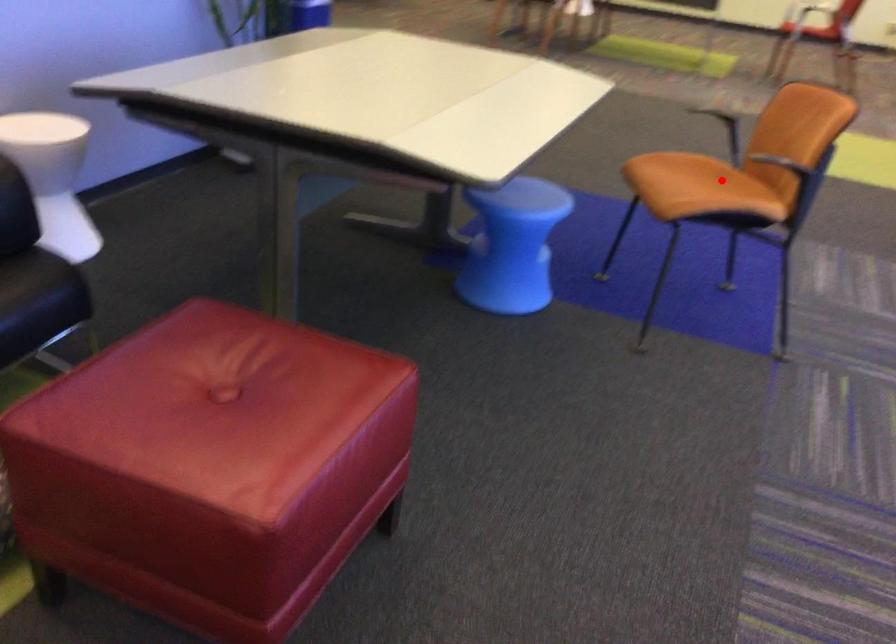
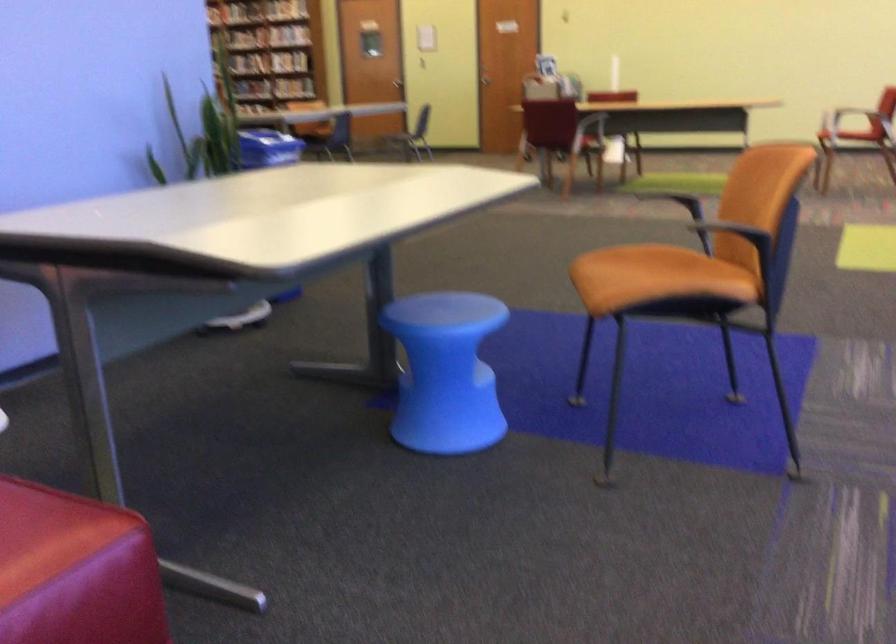
Find the pixel in the second image that matches the highlighted location in the first image.

(682, 270)